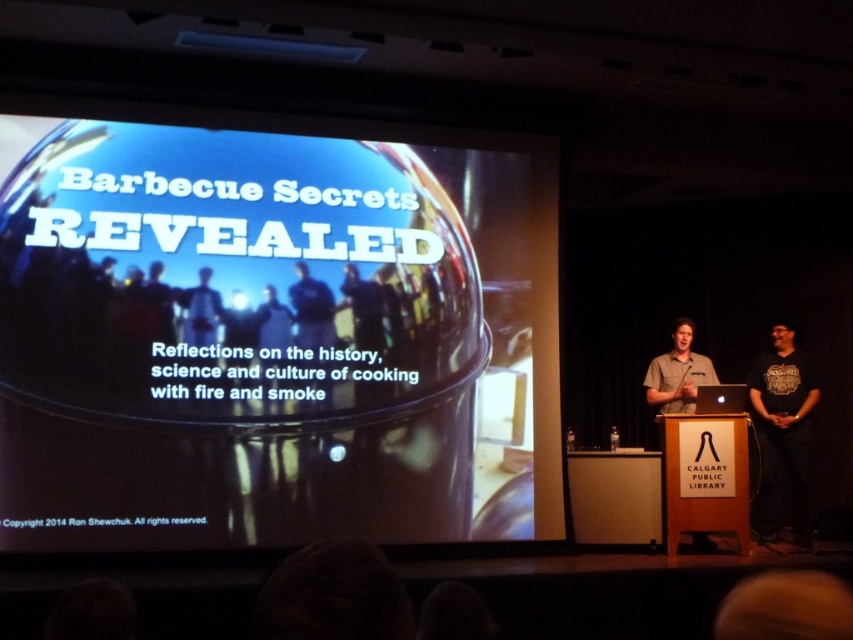
Can you confirm if matte black barbecue grill at center is positioned below matte black shirt at center?

Yes.

Is matte black barbecue grill at center above matte black shirt at center?

No.

At what (x,y) coordinates should I click in order to perform the action: click on matte black barbecue grill at center. Please return your answer as a coordinate pair (x, y). This screenshot has width=853, height=640. Looking at the image, I should click on (273, 339).

Which is in front, point (799, 381) or point (209, 289)?

Point (209, 289) is in front.

Who is higher up, black cotton t-shirt at right or matte black shirt at center?

matte black shirt at center is above.

Is point (770, 413) positioned in front of point (184, 304)?

No, it is not.

Locate an element on the screen. Image resolution: width=853 pixels, height=640 pixels. black cotton t-shirt at right is located at coordinates (782, 432).

Can you confirm if matte black barbecue grill at center is positioned to the right of black cotton t-shirt at right?

No, matte black barbecue grill at center is not to the right of black cotton t-shirt at right.

Locate an element on the screen. This screenshot has width=853, height=640. matte black barbecue grill at center is located at coordinates (273, 339).